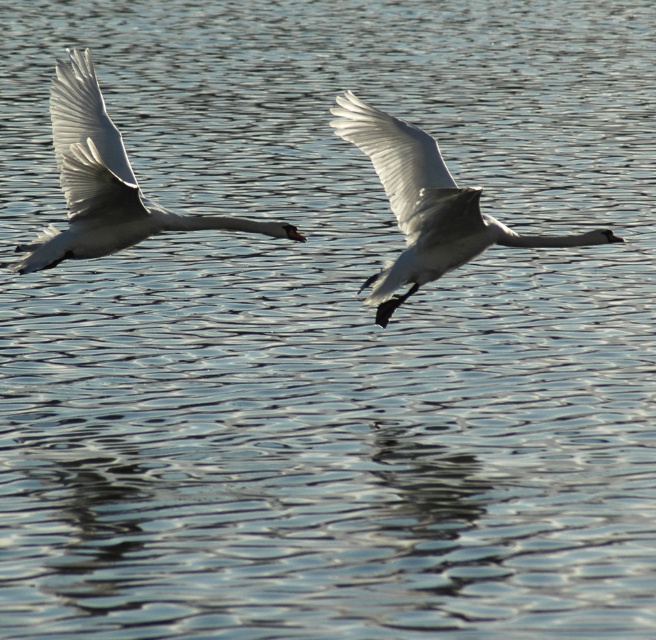
You are a wildlife photographer aiming to capture a photo of the white glossy swan at center and the white glossy wing at center. Your camera has a minimum focus distance of 6 inches. Can you focus on both subjects simultaneously without moving your position?

The distance between the white glossy swan at center and the white glossy wing at center is 5.92 inches, which is less than the camera minimum focus distance of 6 inches. Therefore, you cannot focus on both subjects simultaneously without moving your position.

You are a photographer trying to capture the two swans in flight. The white glossy swan at left and the other swan are 5.74 meters apart. If your camera has a zoom lens that can focus on objects up to 5 meters apart, will you be able to capture both swans in a single clear shot?

The white glossy swan at left and the other swan are 5.74 meters apart, which exceeds the camera lens focus range of 5 meters. Therefore, you cannot capture both swans in a single clear shot.